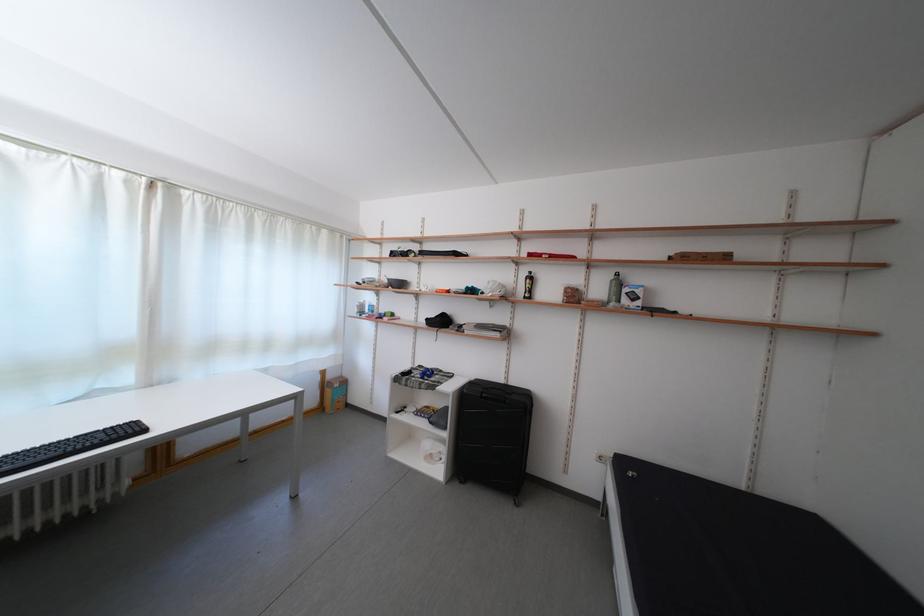
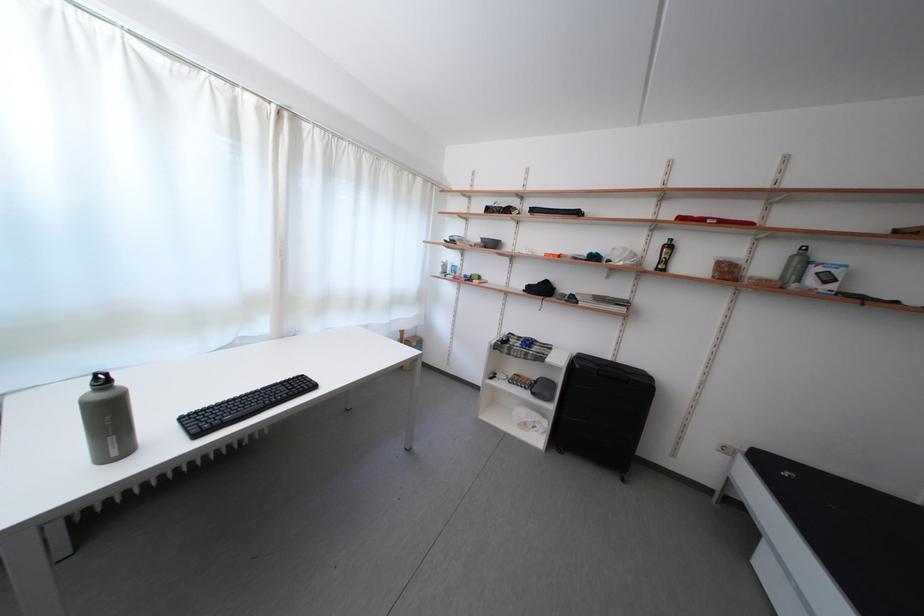
In the second image, find the point that corresponds to [622,283] in the first image.

(804, 257)